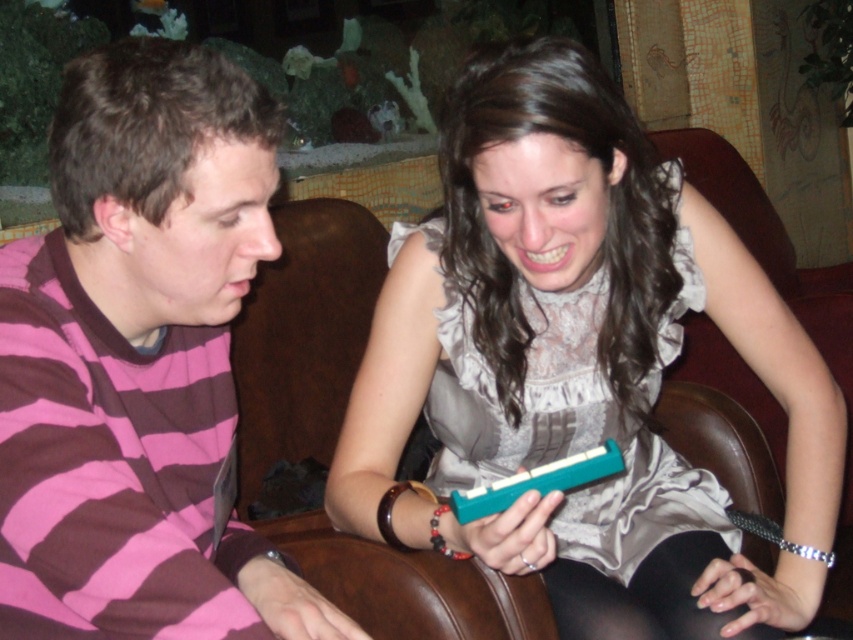
Can you confirm if teal plastic harmonica at center is bigger than pink striped shirt at left?

Correct, teal plastic harmonica at center is larger in size than pink striped shirt at left.

Does point (730, 561) come closer to viewer compared to point (86, 195)?

No, (730, 561) is further to viewer.

Locate an element on the screen. teal plastic harmonica at center is located at coordinates (579, 364).